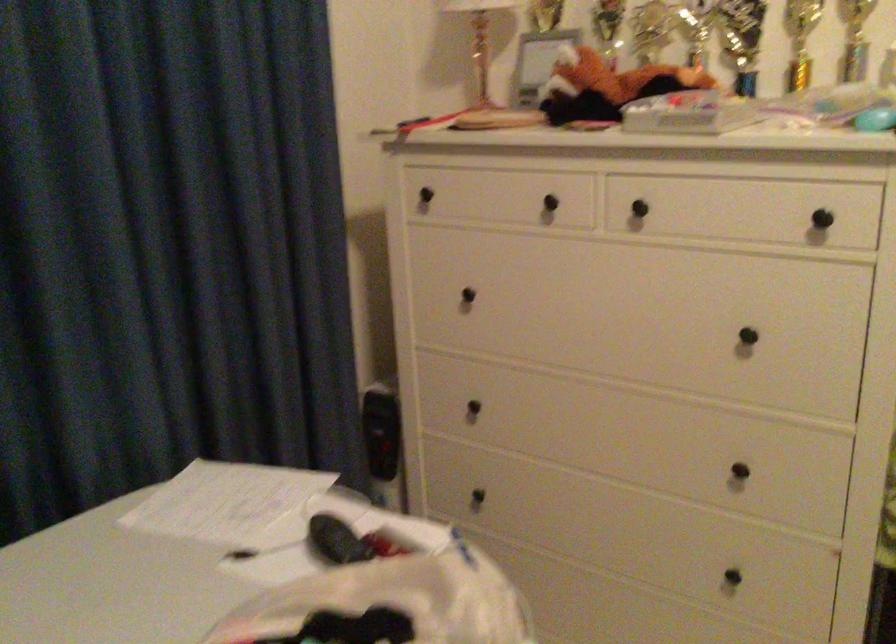
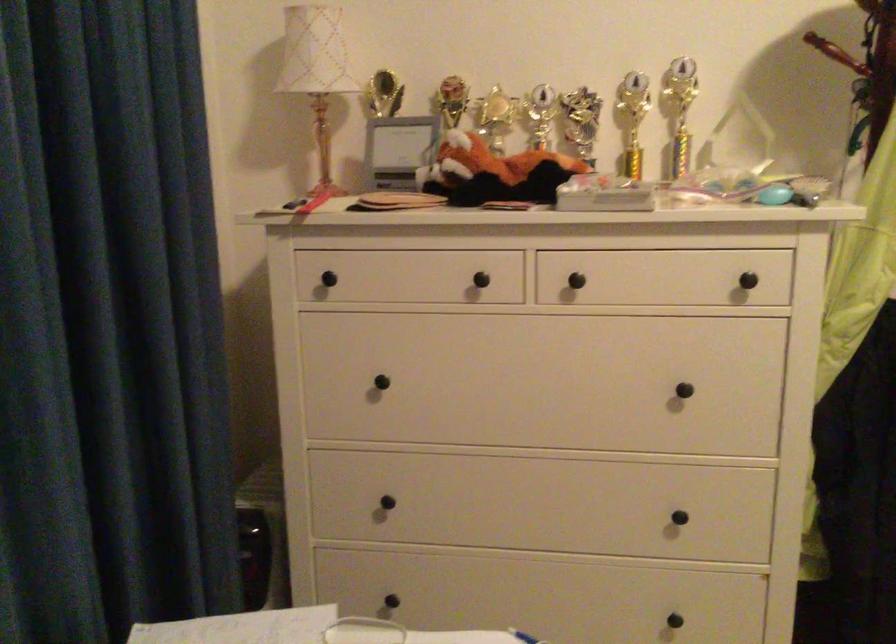
What movement of the cameraman would produce the second image?

The cameraman moved toward left, forward.